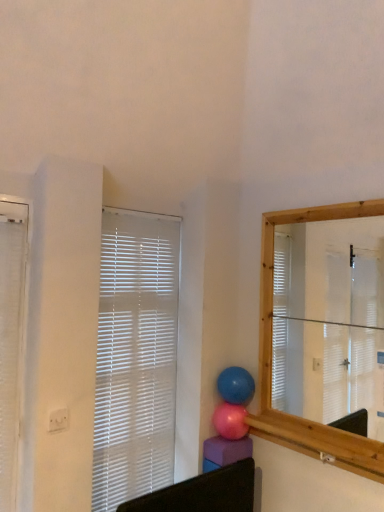
The image size is (384, 512). What do you see at coordinates (135, 356) in the screenshot?
I see `white plastic blinds at upper left, marked as the 2th window blind in a front-to-back arrangement` at bounding box center [135, 356].

Describe the element at coordinates (236, 385) in the screenshot. I see `glossy blue balloon at center, which ranks as the 2th balloon in bottom-to-top order` at that location.

You are a GUI agent. You are given a task and a screenshot of the screen. Output one action in this format:
    pyautogui.click(x=<x>, y=<y>)
    Task: Click on the white textured window blind at left, arranged as the 1th window blind when viewed from the front
    
    Given the screenshot: What is the action you would take?
    pyautogui.click(x=11, y=341)

Measure the distance from glossy blue balloon at center, the first balloon positioned from the top, to white textured window blind at left, arranged as the 1th window blind when viewed from the front.

They are 1.09 meters apart.

From a real-world perspective, who is located higher, glossy blue balloon at center, which ranks as the 2th balloon in bottom-to-top order, or white textured window blind at left, which ranks as the second window blind in back-to-front order?

From a 3D spatial view, white textured window blind at left, which ranks as the second window blind in back-to-front order, is above.

Which is less distant, (243, 388) or (23, 327)?

Clearly, point (243, 388) is more distant from the camera than point (23, 327).

Is glossy blue balloon at center, the first balloon positioned from the top, facing towards white textured window blind at left, acting as the second window blind starting from the right?

Yes, glossy blue balloon at center, the first balloon positioned from the top, is facing white textured window blind at left, acting as the second window blind starting from the right.

Is glossy blue balloon at center, the first balloon positioned from the top, to the left or to the right of white plastic blinds at upper left, which is counted as the 2th window blind, starting from the left, in the image?

Clearly, glossy blue balloon at center, the first balloon positioned from the top, is on the right of white plastic blinds at upper left, which is counted as the 2th window blind, starting from the left, in the image.

Is point (225, 382) closer to camera compared to point (153, 243)?

Yes.

Consider the image. From a real-world perspective, is glossy blue balloon at center, which ranks as the 2th balloon in bottom-to-top order, physically below white plastic blinds at upper left, which ranks as the first window blind in right-to-left order?

Yes.

Identify the location of window blind that is the 1st object located above the glossy blue balloon at center, which ranks as the 2th balloon in bottom-to-top order (from the image's perspective). The height and width of the screenshot is (512, 384). (135, 356).

From a real-world perspective, is pink rubber balloon at center, the 1th balloon from the bottom, positioned over white textured window blind at left, which ranks as the second window blind in back-to-front order, based on gravity?

Actually, pink rubber balloon at center, the 1th balloon from the bottom, is physically below white textured window blind at left, which ranks as the second window blind in back-to-front order, in the real world.

Which object is further away from the camera taking this photo, pink rubber balloon at center, the 1th balloon from the bottom, or white textured window blind at left, positioned as the first window blind in left-to-right order?

pink rubber balloon at center, the 1th balloon from the bottom, is more distant.

Where is `the 2nd window blind in front when counting from the pink rubber balloon at center, the 1th balloon from the bottom`? The image size is (384, 512). the 2nd window blind in front when counting from the pink rubber balloon at center, the 1th balloon from the bottom is located at coordinates (11, 341).

From a real-world perspective, which object stands above the other?

white plastic blinds at upper left, which is counted as the 2th window blind, starting from the left, from a real-world perspective.

Is white plastic blinds at upper left, which ranks as the first window blind in right-to-left order, at the right side of pink rubber balloon at center, the second balloon positioned from the top?

Incorrect, white plastic blinds at upper left, which ranks as the first window blind in right-to-left order, is not on the right side of pink rubber balloon at center, the second balloon positioned from the top.

Which is farther, (x=99, y=401) or (x=229, y=422)?

The point (x=229, y=422) is farther from the camera.

In the scene shown: Is pink rubber balloon at center, the 1th balloon from the bottom, aimed at white plastic blinds at upper left, which ranks as the first window blind in right-to-left order?

No, pink rubber balloon at center, the 1th balloon from the bottom, is not aimed at white plastic blinds at upper left, which ranks as the first window blind in right-to-left order.

From the image's perspective, which one is positioned lower, pink rubber balloon at center, the second balloon positioned from the top, or white plastic blinds at upper left, the first window blind from the back?

pink rubber balloon at center, the second balloon positioned from the top, from the image's perspective.

Considering the relative positions of pink rubber balloon at center, the 1th balloon from the bottom, and white plastic blinds at upper left, the first window blind from the back, in the image provided, is pink rubber balloon at center, the 1th balloon from the bottom, in front of white plastic blinds at upper left, the first window blind from the back,?

No, it is not.

Which object is wider, pink rubber balloon at center, the 1th balloon from the bottom, or white plastic blinds at upper left, which is counted as the 2th window blind, starting from the left?

pink rubber balloon at center, the 1th balloon from the bottom.

Would you consider white textured window blind at left, which ranks as the second window blind in back-to-front order, to be distant from white plastic blinds at upper left, which ranks as the first window blind in right-to-left order?

No, white textured window blind at left, which ranks as the second window blind in back-to-front order, is not far away from white plastic blinds at upper left, which ranks as the first window blind in right-to-left order.

Does white textured window blind at left, positioned as the first window blind in left-to-right order, have a lesser width compared to white plastic blinds at upper left, the first window blind from the back?

No, white textured window blind at left, positioned as the first window blind in left-to-right order, is not thinner than white plastic blinds at upper left, the first window blind from the back.

Is white textured window blind at left, acting as the second window blind starting from the right, aimed at white plastic blinds at upper left, which ranks as the first window blind in right-to-left order?

No, white textured window blind at left, acting as the second window blind starting from the right, is not oriented towards white plastic blinds at upper left, which ranks as the first window blind in right-to-left order.

Image resolution: width=384 pixels, height=512 pixels. I want to click on window blind in front of the white plastic blinds at upper left, marked as the 2th window blind in a front-to-back arrangement, so click(x=11, y=341).

How far apart are white plastic blinds at upper left, the first window blind from the back, and white textured window blind at left, which ranks as the second window blind in back-to-front order?

white plastic blinds at upper left, the first window blind from the back, and white textured window blind at left, which ranks as the second window blind in back-to-front order, are 23.00 inches apart.

Which object is further away from the camera taking this photo, white plastic blinds at upper left, which is counted as the 2th window blind, starting from the left, or white textured window blind at left, arranged as the 1th window blind when viewed from the front?

white plastic blinds at upper left, which is counted as the 2th window blind, starting from the left, is further away from the camera.

Is point (164, 416) more distant than point (11, 209)?

Yes.

This screenshot has width=384, height=512. I want to click on window blind on the right side of white textured window blind at left, arranged as the 1th window blind when viewed from the front, so click(135, 356).

You are a GUI agent. You are given a task and a screenshot of the screen. Output one action in this format:
    pyautogui.click(x=<x>, y=<y>)
    Task: Click on the 2nd window blind in front of the glossy blue balloon at center, the first balloon positioned from the top
    
    Given the screenshot: What is the action you would take?
    pyautogui.click(x=11, y=341)

Image resolution: width=384 pixels, height=512 pixels. I want to click on the 1st window blind counting from the left side of the glossy blue balloon at center, which ranks as the 2th balloon in bottom-to-top order, so click(135, 356).

Considering their positions, is glossy blue balloon at center, the first balloon positioned from the top, positioned further to white plastic blinds at upper left, which ranks as the first window blind in right-to-left order, than white textured window blind at left, which ranks as the second window blind in back-to-front order?

The object further to white plastic blinds at upper left, which ranks as the first window blind in right-to-left order, is white textured window blind at left, which ranks as the second window blind in back-to-front order.

Considering their positions, is glossy blue balloon at center, the first balloon positioned from the top, positioned closer to pink rubber balloon at center, the second balloon positioned from the top, than white textured window blind at left, arranged as the 1th window blind when viewed from the front?

glossy blue balloon at center, the first balloon positioned from the top, is closer to pink rubber balloon at center, the second balloon positioned from the top.

Considering their positions, is white plastic blinds at upper left, which is counted as the 2th window blind, starting from the left, positioned further to pink rubber balloon at center, the second balloon positioned from the top, than glossy blue balloon at center, the first balloon positioned from the top?

The object further to pink rubber balloon at center, the second balloon positioned from the top, is white plastic blinds at upper left, which is counted as the 2th window blind, starting from the left.

Based on their spatial positions, is white plastic blinds at upper left, marked as the 2th window blind in a front-to-back arrangement, or pink rubber balloon at center, the second balloon positioned from the top, closer to white textured window blind at left, positioned as the first window blind in left-to-right order?

Among the two, white plastic blinds at upper left, marked as the 2th window blind in a front-to-back arrangement, is located nearer to white textured window blind at left, positioned as the first window blind in left-to-right order.

Based on their spatial positions, is white plastic blinds at upper left, which is counted as the 2th window blind, starting from the left, or white textured window blind at left, arranged as the 1th window blind when viewed from the front, closer to pink rubber balloon at center, the 1th balloon from the bottom?

white plastic blinds at upper left, which is counted as the 2th window blind, starting from the left, is closer to pink rubber balloon at center, the 1th balloon from the bottom.

When comparing their distances from white plastic blinds at upper left, which ranks as the first window blind in right-to-left order, does white textured window blind at left, arranged as the 1th window blind when viewed from the front, or pink rubber balloon at center, the 1th balloon from the bottom, seem further?

white textured window blind at left, arranged as the 1th window blind when viewed from the front, lies further to white plastic blinds at upper left, which ranks as the first window blind in right-to-left order, than the other object.

Looking at the image, which one is located closer to white textured window blind at left, positioned as the first window blind in left-to-right order, glossy blue balloon at center, the first balloon positioned from the top, or pink rubber balloon at center, the 1th balloon from the bottom?

pink rubber balloon at center, the 1th balloon from the bottom.

Looking at the image, which one is located closer to white textured window blind at left, acting as the second window blind starting from the right, white plastic blinds at upper left, the first window blind from the back, or glossy blue balloon at center, the first balloon positioned from the top?

A: white plastic blinds at upper left, the first window blind from the back, is closer to white textured window blind at left, acting as the second window blind starting from the right.

The width and height of the screenshot is (384, 512). Identify the location of window blind located between white textured window blind at left, acting as the second window blind starting from the right, and glossy blue balloon at center, which ranks as the 2th balloon in bottom-to-top order, in the left-right direction. (135, 356).

Identify the location of balloon between white textured window blind at left, acting as the second window blind starting from the right, and glossy blue balloon at center, which ranks as the 2th balloon in bottom-to-top order, from left to right. This screenshot has height=512, width=384. (230, 421).

You are a GUI agent. You are given a task and a screenshot of the screen. Output one action in this format:
    pyautogui.click(x=<x>, y=<y>)
    Task: Click on the balloon between white plastic blinds at upper left, marked as the 2th window blind in a front-to-back arrangement, and glossy blue balloon at center, which ranks as the 2th balloon in bottom-to-top order, from left to right
    The width and height of the screenshot is (384, 512).
    Given the screenshot: What is the action you would take?
    pyautogui.click(x=230, y=421)

Where is `window blind situated between white textured window blind at left, arranged as the 1th window blind when viewed from the front, and pink rubber balloon at center, the 1th balloon from the bottom, from left to right`? The image size is (384, 512). window blind situated between white textured window blind at left, arranged as the 1th window blind when viewed from the front, and pink rubber balloon at center, the 1th balloon from the bottom, from left to right is located at coordinates (135, 356).